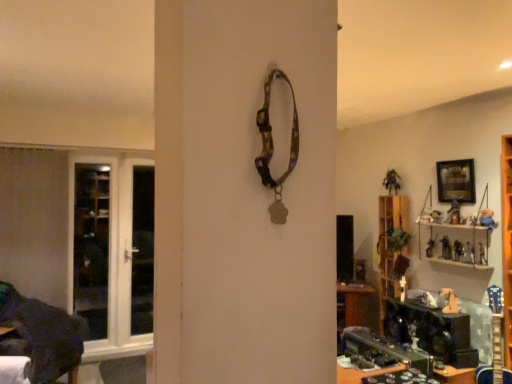
Question: Considering the relative sizes of wooden framed picture at upper right and transparent glass screen door at left in the image provided, is wooden framed picture at upper right bigger than transparent glass screen door at left?

Choices:
 (A) yes
 (B) no

Answer: (B)

Question: From a real-world perspective, is wooden framed picture at upper right positioned over transparent glass screen door at left based on gravity?

Choices:
 (A) no
 (B) yes

Answer: (B)

Question: Considering the relative positions of wooden framed picture at upper right and transparent glass screen door at left in the image provided, is wooden framed picture at upper right to the left of transparent glass screen door at left from the viewer's perspective?

Choices:
 (A) yes
 (B) no

Answer: (B)

Question: Is wooden framed picture at upper right shorter than transparent glass screen door at left?

Choices:
 (A) yes
 (B) no

Answer: (A)

Question: Does wooden framed picture at upper right have a smaller size compared to transparent glass screen door at left?

Choices:
 (A) no
 (B) yes

Answer: (B)

Question: Is wooden framed picture at upper right at the right side of transparent glass screen door at left?

Choices:
 (A) no
 (B) yes

Answer: (B)

Question: Considering the relative sizes of wooden framed picture at upper right and wooden shelf at right in the image provided, is wooden framed picture at upper right taller than wooden shelf at right?

Choices:
 (A) no
 (B) yes

Answer: (A)

Question: Does wooden framed picture at upper right contain wooden shelf at right?

Choices:
 (A) yes
 (B) no

Answer: (B)

Question: Can we say wooden framed picture at upper right lies outside wooden shelf at right?

Choices:
 (A) yes
 (B) no

Answer: (B)

Question: Does wooden framed picture at upper right appear on the left side of wooden shelf at right?

Choices:
 (A) no
 (B) yes

Answer: (A)

Question: Can you confirm if wooden framed picture at upper right is smaller than wooden shelf at right?

Choices:
 (A) yes
 (B) no

Answer: (A)

Question: Is wooden framed picture at upper right wider than wooden shelf at right?

Choices:
 (A) no
 (B) yes

Answer: (A)

Question: Is wooden shelf at right positioned beyond the bounds of wooden framed picture at upper right?

Choices:
 (A) no
 (B) yes

Answer: (B)